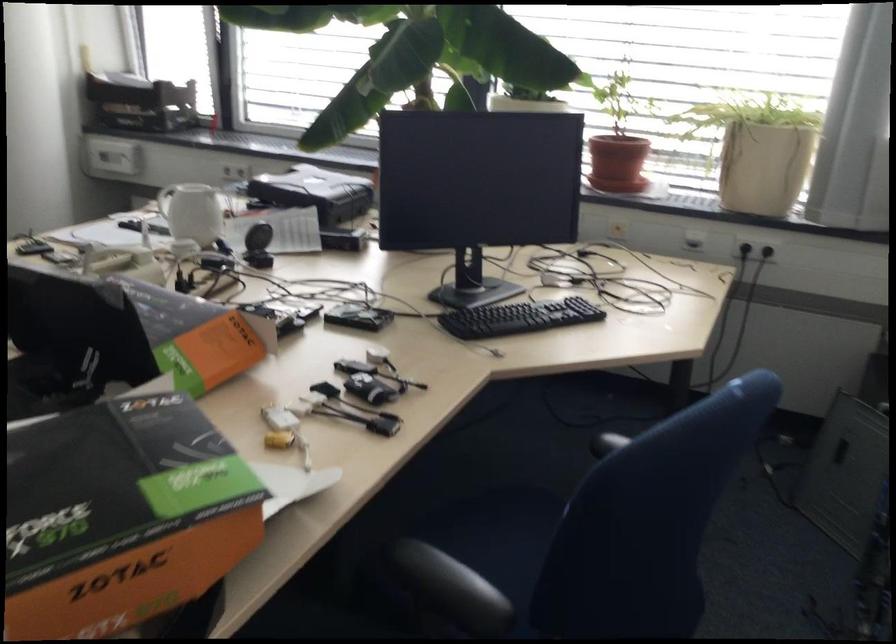
Describe the element at coordinates (479, 554) in the screenshot. I see `the black chair armrest` at that location.